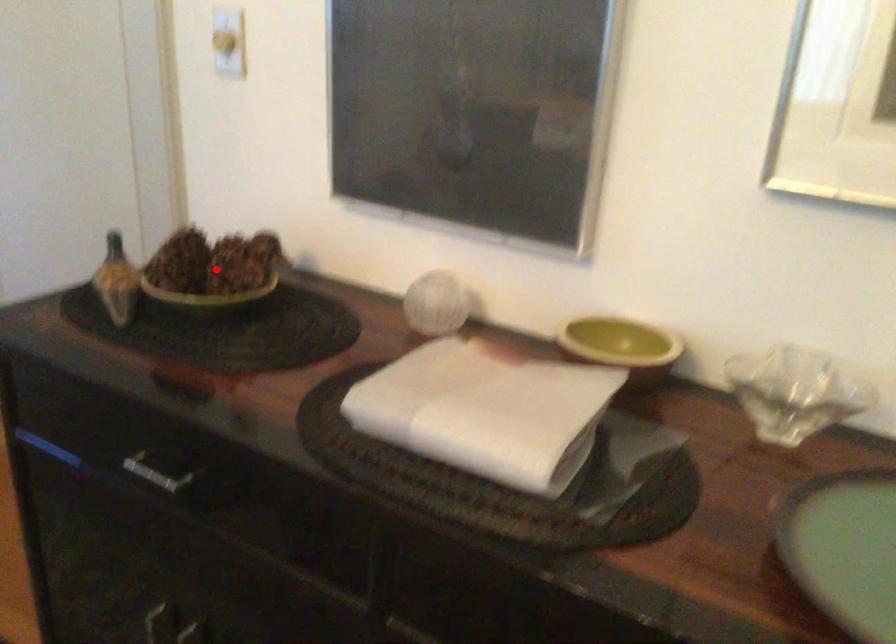
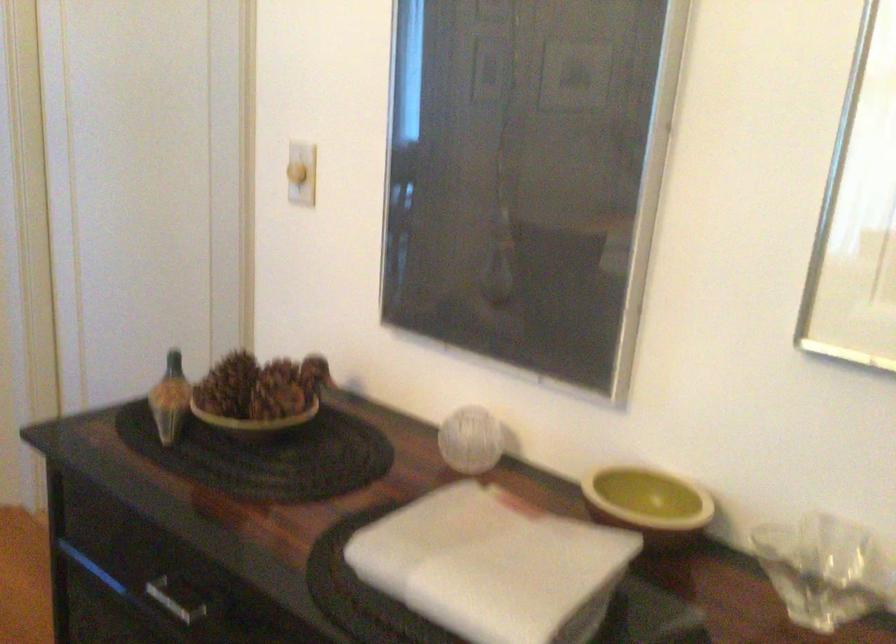
Where in the second image is the point corresponding to the highlighted location from the first image?

(259, 395)